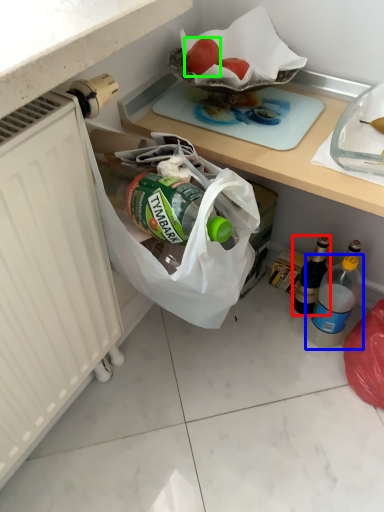
Question: Based on their relative distances, which object is farther from bottle (highlighted by a red box)? Choose from bottle (highlighted by a blue box) and fruit (highlighted by a green box).

Choices:
 (A) bottle
 (B) fruit

Answer: (B)